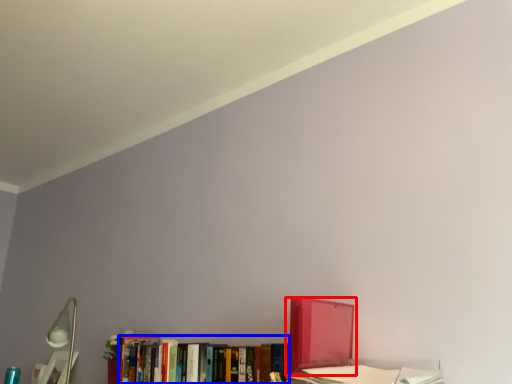
Question: Among these objects, which one is nearest to the camera, book (highlighted by a red box) or book (highlighted by a blue box)?

Choices:
 (A) book
 (B) book

Answer: (A)